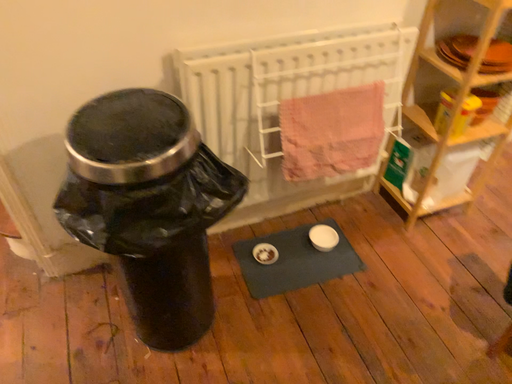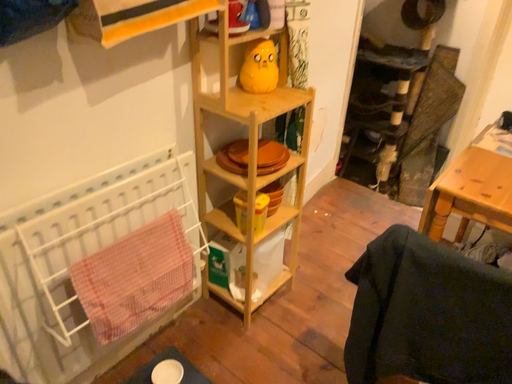
Question: How did the camera likely rotate when shooting the video?

Choices:
 (A) rotated downward
 (B) rotated upward

Answer: (B)